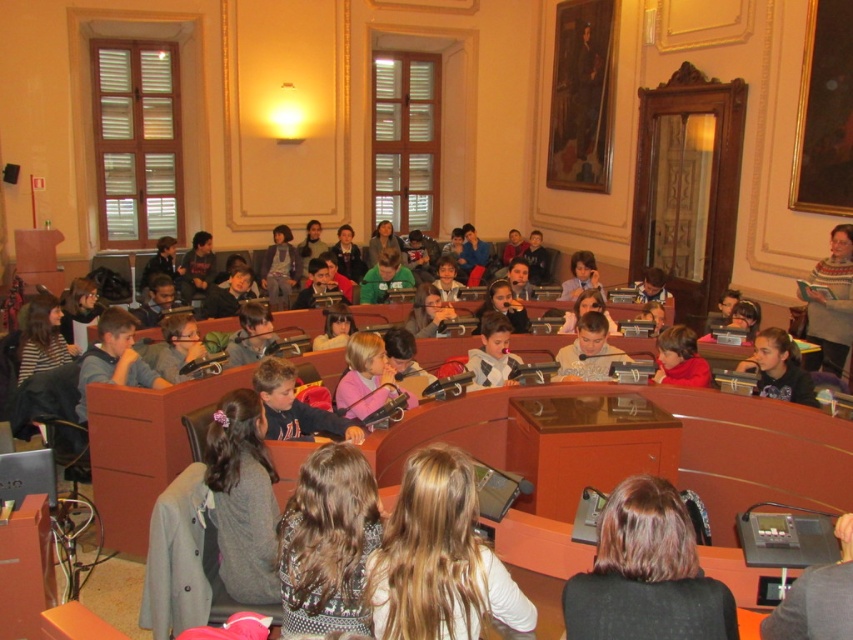
You are a photographer standing at the back of the room. You want to take a photo of both the blonde hair at center and the brown hair at center without anyone blocking them. Which person should you adjust to move forward so that both are visible?

The brown hair at center is behind the blonde hair at center, so you should ask the brown hair at center to move forward so that both are visible.

From the picture: You are a photographer at the back of the room and want to take a photo of both the blonde hair at center and the brown hair at center. Which one should you pan your camera to the left to capture?

The blonde hair at center is positioned on the left side of brown hair at center, so to capture both, you should pan your camera to the left to include the blonde hair at center first, then adjust to include the brown hair at center on the right.